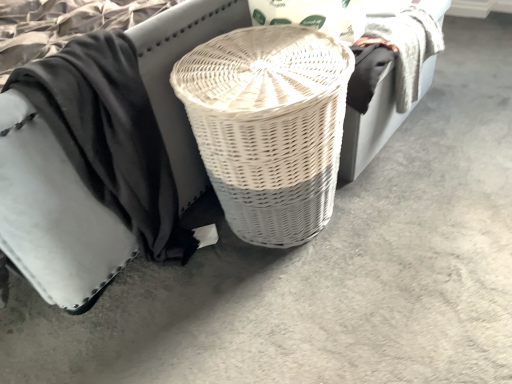
Question: From the image's perspective, is white wicker basket at center above black cotton cloth at center?

Choices:
 (A) yes
 (B) no

Answer: (B)

Question: Is the depth of white wicker basket at center less than that of black cotton cloth at center?

Choices:
 (A) yes
 (B) no

Answer: (B)

Question: Is black cotton cloth at center surrounded by white wicker basket at center?

Choices:
 (A) yes
 (B) no

Answer: (B)

Question: Is white wicker basket at center to the right of black cotton cloth at center from the viewer's perspective?

Choices:
 (A) no
 (B) yes

Answer: (B)

Question: Does white wicker basket at center have a lesser height compared to black cotton cloth at center?

Choices:
 (A) yes
 (B) no

Answer: (A)

Question: Is black cotton cloth at center to the left or to the right of white wicker basket at center in the image?

Choices:
 (A) right
 (B) left

Answer: (B)

Question: Is point (123, 163) positioned closer to the camera than point (205, 135)?

Choices:
 (A) farther
 (B) closer

Answer: (A)

Question: Is black cotton cloth at center in front of or behind white wicker basket at center in the image?

Choices:
 (A) front
 (B) behind

Answer: (A)

Question: Looking at the image, does black cotton cloth at center seem bigger or smaller compared to white wicker basket at center?

Choices:
 (A) big
 (B) small

Answer: (A)

Question: In the image, is white wicker basket at center positioned in front of or behind black cotton cloth at center?

Choices:
 (A) front
 (B) behind

Answer: (A)

Question: From a real-world perspective, relative to black cotton cloth at center, is white wicker basket at center vertically above or below?

Choices:
 (A) below
 (B) above

Answer: (B)

Question: Is white wicker basket at center wider or thinner than black cotton cloth at center?

Choices:
 (A) wide
 (B) thin

Answer: (A)

Question: Based on their sizes in the image, would you say white wicker basket at center is bigger or smaller than black cotton cloth at center?

Choices:
 (A) big
 (B) small

Answer: (A)

Question: Considering the relative positions of white wicker basket at center and white wicker basket at center in the image provided, is white wicker basket at center to the left or to the right of white wicker basket at center?

Choices:
 (A) right
 (B) left

Answer: (A)

Question: Does point (325, 117) appear closer or farther from the camera than point (42, 147)?

Choices:
 (A) closer
 (B) farther

Answer: (B)